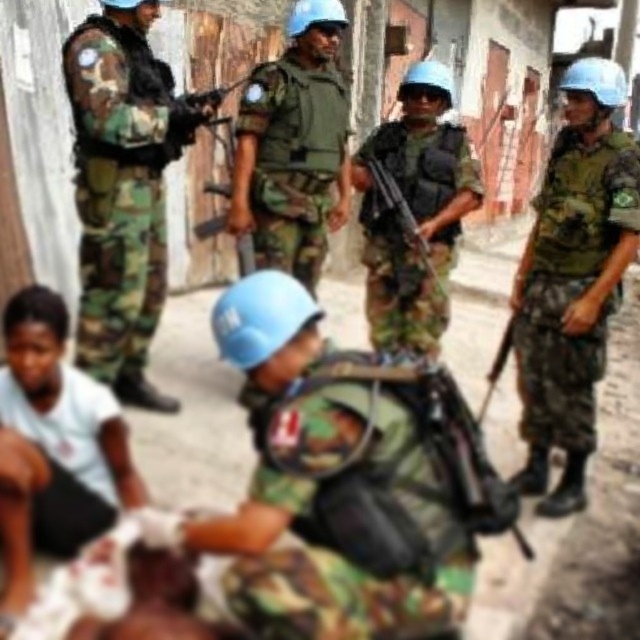
Question: Which object is closer to the camera taking this photo?

Choices:
 (A) camo fabric backpack at center
 (B) camouflage fabric uniform at right
 (C) matte black rifle at center

Answer: (A)

Question: Which point appears closest to the camera in this image?

Choices:
 (A) (561, 272)
 (B) (60, 529)
 (C) (93, 243)

Answer: (B)

Question: Is camo fabric backpack at center bigger than camouflage fabric uniform at center?

Choices:
 (A) no
 (B) yes

Answer: (A)

Question: Which of the following is the closest to the observer?

Choices:
 (A) camouflage fabric rifle at center
 (B) camouflage fabric uniform at center

Answer: (A)

Question: Is camouflage fabric uniform at left thinner than matte black rifle at center?

Choices:
 (A) no
 (B) yes

Answer: (A)

Question: Does camouflage fabric uniform at left have a greater width compared to camouflage fabric uniform at center?

Choices:
 (A) yes
 (B) no

Answer: (B)